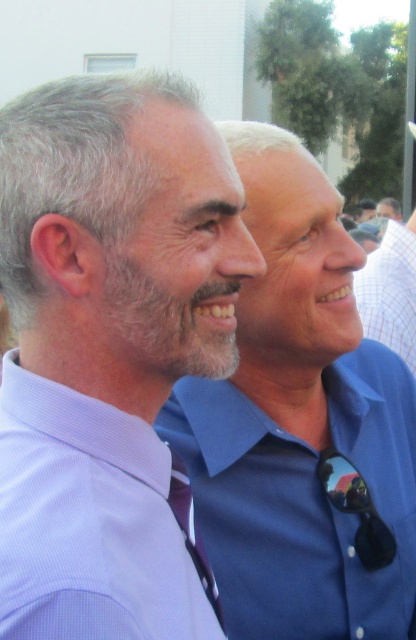
Between matte purple tie at left and matte blue shirt at center, which one has less height?

Standing shorter between the two is matte purple tie at left.

Describe the element at coordinates (108, 348) in the screenshot. I see `matte purple tie at left` at that location.

Find the location of `matte purple tie at left`. matte purple tie at left is located at coordinates (108, 348).

You are a GUI agent. You are given a task and a screenshot of the screen. Output one action in this format:
    pyautogui.click(x=<x>, y=<y>)
    Task: Click on the lavender textured dress shirt at left
    
    Given the screenshot: What is the action you would take?
    pyautogui.click(x=89, y=522)

Can you confirm if lavender textured dress shirt at left is smaller than matte blue shirt at center?

Yes, lavender textured dress shirt at left is smaller than matte blue shirt at center.

Identify the location of lavender textured dress shirt at left. This screenshot has height=640, width=416. (89, 522).

What are the coordinates of `lavender textured dress shirt at left` in the screenshot? It's located at (89, 522).

Measure the distance between lavender textured dress shirt at left and purple satin tie at center.

lavender textured dress shirt at left is 18.13 centimeters from purple satin tie at center.

Can you confirm if lavender textured dress shirt at left is taller than purple satin tie at center?

Correct, lavender textured dress shirt at left is much taller as purple satin tie at center.

Does point (123, 564) lie in front of point (217, 596)?

Yes, point (123, 564) is closer to viewer.

You are a GUI agent. You are given a task and a screenshot of the screen. Output one action in this format:
    pyautogui.click(x=<x>, y=<y>)
    Task: Click on the lavender textured dress shirt at left
    
    Given the screenshot: What is the action you would take?
    pyautogui.click(x=89, y=522)